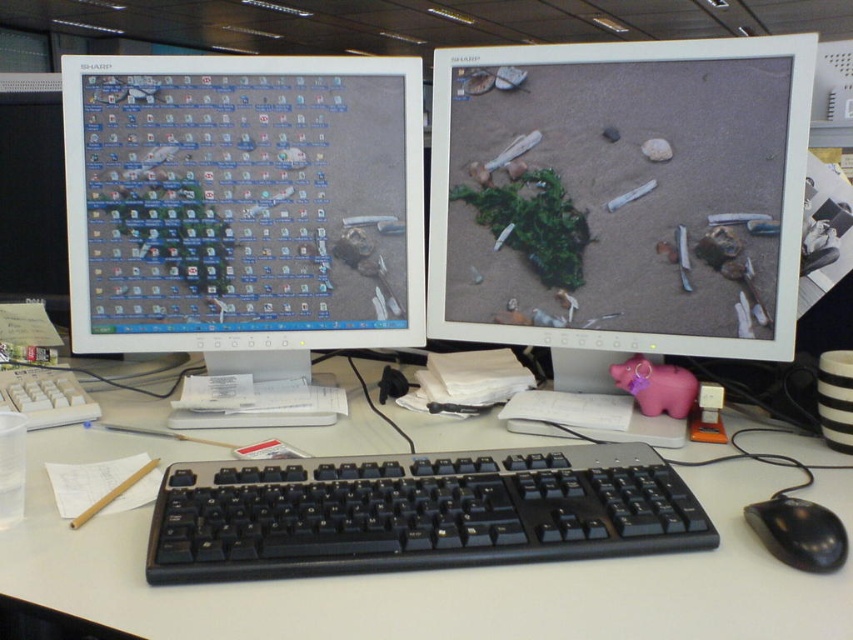
Who is positioned more to the left, black plastic keyboard at center or black plastic mouse at lower right?

black plastic keyboard at center

Locate an element on the screen. black plastic keyboard at center is located at coordinates (416, 513).

Does point (573, 476) come in front of point (846, 544)?

No, (573, 476) is behind (846, 544).

Identify the location of black plastic keyboard at center. (416, 513).

Which is below, white plastic keyboard at center or black plastic mouse at lower right?

black plastic mouse at lower right is lower down.

Who is taller, white plastic keyboard at center or black plastic mouse at lower right?

With more height is white plastic keyboard at center.

You are a GUI agent. You are given a task and a screenshot of the screen. Output one action in this format:
    pyautogui.click(x=<x>, y=<y>)
    Task: Click on the white plastic keyboard at center
    The height and width of the screenshot is (640, 853).
    Given the screenshot: What is the action you would take?
    pyautogui.click(x=431, y=573)

Can you confirm if matte plastic monitor at left is taller than white plastic keyboard at center?

Correct, matte plastic monitor at left is much taller as white plastic keyboard at center.

This screenshot has height=640, width=853. In order to click on matte plastic monitor at left in this screenshot , I will do `click(242, 208)`.

The width and height of the screenshot is (853, 640). Find the location of `matte plastic monitor at left`. matte plastic monitor at left is located at coordinates (242, 208).